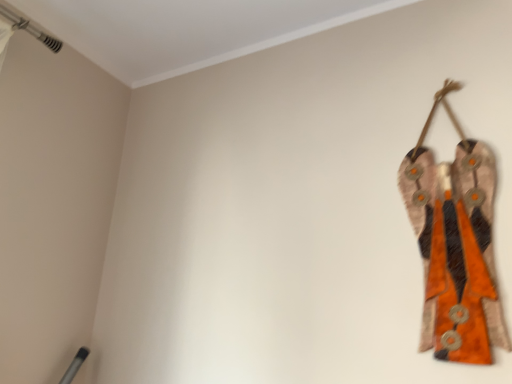
Question: Can you confirm if white smooth ceiling trim at upper left is positioned to the left of textured orange fabric at right?

Choices:
 (A) no
 (B) yes

Answer: (B)

Question: Would you say textured orange fabric at right is part of white smooth ceiling trim at upper left's contents?

Choices:
 (A) yes
 (B) no

Answer: (B)

Question: Are white smooth ceiling trim at upper left and textured orange fabric at right far apart?

Choices:
 (A) yes
 (B) no

Answer: (B)

Question: Is white smooth ceiling trim at upper left in front of textured orange fabric at right?

Choices:
 (A) yes
 (B) no

Answer: (A)

Question: Is the surface of white smooth ceiling trim at upper left in direct contact with textured orange fabric at right?

Choices:
 (A) no
 (B) yes

Answer: (A)

Question: Can you confirm if white smooth ceiling trim at upper left is shorter than textured orange fabric at right?

Choices:
 (A) yes
 (B) no

Answer: (A)

Question: Does textured orange fabric at right have a lesser width compared to white smooth ceiling trim at upper left?

Choices:
 (A) yes
 (B) no

Answer: (A)

Question: Does textured orange fabric at right turn towards white smooth ceiling trim at upper left?

Choices:
 (A) yes
 (B) no

Answer: (B)

Question: Is textured orange fabric at right touching white smooth ceiling trim at upper left?

Choices:
 (A) yes
 (B) no

Answer: (B)

Question: Does textured orange fabric at right have a lesser height compared to white smooth ceiling trim at upper left?

Choices:
 (A) no
 (B) yes

Answer: (A)

Question: Can you confirm if textured orange fabric at right is smaller than white smooth ceiling trim at upper left?

Choices:
 (A) no
 (B) yes

Answer: (B)

Question: From the image's perspective, is textured orange fabric at right located above white smooth ceiling trim at upper left?

Choices:
 (A) yes
 (B) no

Answer: (B)

Question: From the image's perspective, is textured orange fabric at right located above or below white smooth ceiling trim at upper left?

Choices:
 (A) below
 (B) above

Answer: (A)